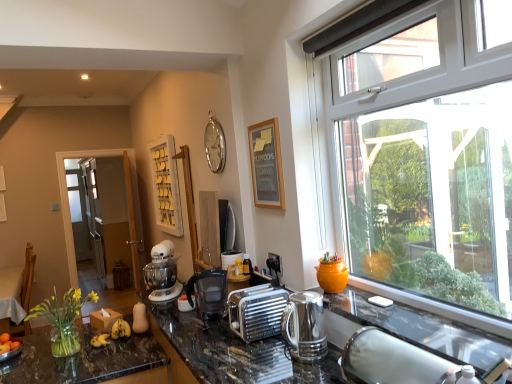
Image resolution: width=512 pixels, height=384 pixels. In order to click on vacant region in front of yellow matte bananas at center in this screenshot , I will do `click(112, 352)`.